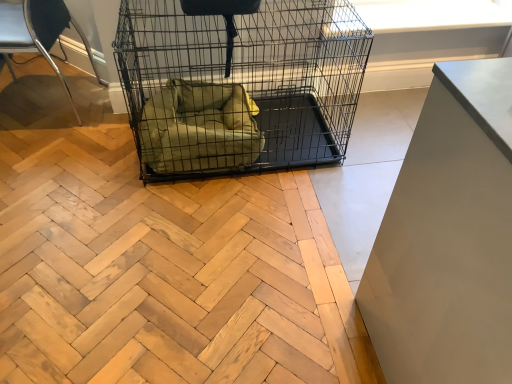
This screenshot has height=384, width=512. What do you see at coordinates (239, 82) in the screenshot? I see `black wire mesh cage at center` at bounding box center [239, 82].

Identify the location of white matte cabinet at right. (448, 237).

Considering the sizes of objects green fabric dog bed at center and black wire mesh cage at center in the image provided, who is smaller, green fabric dog bed at center or black wire mesh cage at center?

green fabric dog bed at center is smaller.

Considering the sizes of objects green fabric dog bed at center and black wire mesh cage at center in the image provided, who is wider, green fabric dog bed at center or black wire mesh cage at center?

Wider between the two is black wire mesh cage at center.

Can you tell me how much green fabric dog bed at center and black wire mesh cage at center differ in facing direction?

green fabric dog bed at center and black wire mesh cage at center are facing 0.000225 degrees away from each other.

From a real-world perspective, is white matte cabinet at right under metallic silver chair at left?

No, from a real-world perspective, white matte cabinet at right is not below metallic silver chair at left.

Locate an element on the screen. The width and height of the screenshot is (512, 384). furniture positioned vertically above the metallic silver chair at left (from a real-world perspective) is located at coordinates (448, 237).

Between white matte cabinet at right and metallic silver chair at left, which one has less height?

metallic silver chair at left is shorter.

Between green fabric dog bed at center and metallic silver chair at left, which one has less height?

green fabric dog bed at center is shorter.

I want to click on chair in front of the green fabric dog bed at center, so click(35, 31).

Is green fabric dog bed at center far from metallic silver chair at left?

green fabric dog bed at center is positioned a significant distance from metallic silver chair at left.

From a real-world perspective, is green fabric dog bed at center located higher than metallic silver chair at left?

No, from a real-world perspective, green fabric dog bed at center is not above metallic silver chair at left.

How many degrees apart are the facing directions of black wire mesh cage at center and metallic silver chair at left?

97.8 degrees separate the facing orientations of black wire mesh cage at center and metallic silver chair at left.

From the picture: Is black wire mesh cage at center looking in the opposite direction of metallic silver chair at left?

No, black wire mesh cage at center's orientation is not away from metallic silver chair at left.

Can you confirm if black wire mesh cage at center is bigger than metallic silver chair at left?

Yes, black wire mesh cage at center is bigger than metallic silver chair at left.

From a real-world perspective, is black wire mesh cage at center beneath metallic silver chair at left?

No, from a real-world perspective, black wire mesh cage at center is not under metallic silver chair at left.

In the scene shown: Which of these two, black wire mesh cage at center or white matte cabinet at right, is wider?

black wire mesh cage at center.

Measure the distance between black wire mesh cage at center and white matte cabinet at right.

black wire mesh cage at center is 1.09 meters away from white matte cabinet at right.

Is black wire mesh cage at center far away from white matte cabinet at right?

Absolutely, black wire mesh cage at center is distant from white matte cabinet at right.

Is black wire mesh cage at center closer to camera compared to green fabric dog bed at center?

Yes, it is.

From the image's perspective, is black wire mesh cage at center located beneath green fabric dog bed at center?

No, from the image's perspective, black wire mesh cage at center is not beneath green fabric dog bed at center.

Can you confirm if black wire mesh cage at center is smaller than green fabric dog bed at center?

No, black wire mesh cage at center is not smaller than green fabric dog bed at center.

How far apart are white matte cabinet at right and black wire mesh cage at center?

A distance of 3.59 feet exists between white matte cabinet at right and black wire mesh cage at center.

What's the angular difference between white matte cabinet at right and black wire mesh cage at center's facing directions?

They differ by 179 degrees in their facing directions.

Considering the points (389, 380) and (247, 9), which point is in front, point (389, 380) or point (247, 9)?

Point (389, 380)

Which of these two, white matte cabinet at right or black wire mesh cage at center, is smaller?

white matte cabinet at right is smaller.

What are the coordinates of `bird cage on the right of the green fabric dog bed at center` in the screenshot? It's located at (239, 82).

Locate an element on the screen. The image size is (512, 384). chair located underneath the white matte cabinet at right (from a real-world perspective) is located at coordinates (35, 31).

Estimate the real-world distances between objects in this image. Which object is further from metallic silver chair at left, black wire mesh cage at center or white matte cabinet at right?

white matte cabinet at right lies further to metallic silver chair at left than the other object.

Which object lies nearer to the anchor point white matte cabinet at right, metallic silver chair at left or green fabric dog bed at center?

Based on the image, green fabric dog bed at center appears to be nearer to white matte cabinet at right.

From the image, which object appears to be nearer to white matte cabinet at right, black wire mesh cage at center or green fabric dog bed at center?

Based on the image, green fabric dog bed at center appears to be nearer to white matte cabinet at right.

Considering their positions, is white matte cabinet at right positioned further to green fabric dog bed at center than black wire mesh cage at center?

white matte cabinet at right is positioned further to the anchor green fabric dog bed at center.

Looking at the image, which one is located closer to metallic silver chair at left, black wire mesh cage at center or green fabric dog bed at center?

green fabric dog bed at center is positioned closer to the anchor metallic silver chair at left.

From the image, which object appears to be farther from green fabric dog bed at center, metallic silver chair at left or white matte cabinet at right?

The object further to green fabric dog bed at center is metallic silver chair at left.

Based on their spatial positions, is black wire mesh cage at center or white matte cabinet at right closer to green fabric dog bed at center?

The object closer to green fabric dog bed at center is black wire mesh cage at center.

Looking at the image, which one is located further to green fabric dog bed at center, black wire mesh cage at center or metallic silver chair at left?

metallic silver chair at left lies further to green fabric dog bed at center than the other object.

This screenshot has width=512, height=384. I want to click on bird cage between metallic silver chair at left and white matte cabinet at right in the horizontal direction, so click(239, 82).

The width and height of the screenshot is (512, 384). I want to click on dog bed located between metallic silver chair at left and black wire mesh cage at center in the left-right direction, so click(x=199, y=128).

This screenshot has height=384, width=512. I want to click on bird cage between white matte cabinet at right and green fabric dog bed at center in the front-back direction, so point(239,82).

Locate an element on the screen. The height and width of the screenshot is (384, 512). dog bed between metallic silver chair at left and white matte cabinet at right is located at coordinates (199, 128).